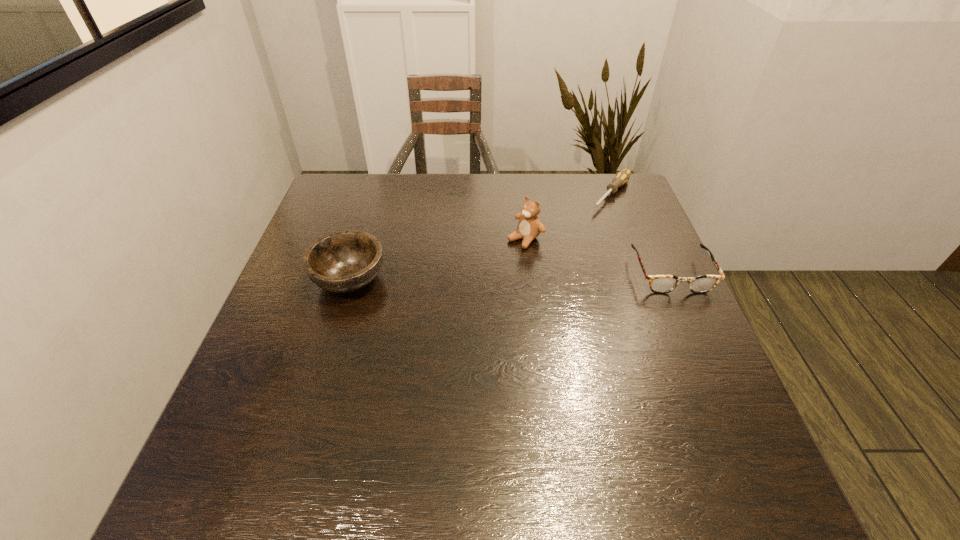
Where is `the second tallest object`? the second tallest object is located at coordinates (344, 261).

The image size is (960, 540). What are the coordinates of `the leftmost object` in the screenshot? It's located at (344, 261).

Identify the location of spectacles. (660, 284).

Find the location of a particular element. The height and width of the screenshot is (540, 960). the shortest object is located at coordinates (622, 177).

Identify the location of the farthest object. The width and height of the screenshot is (960, 540). (622, 177).

You are a GUI agent. You are given a task and a screenshot of the screen. Output one action in this format:
    pyautogui.click(x=<x>, y=<y>)
    Task: Click on the teddy bear
    
    Given the screenshot: What is the action you would take?
    pyautogui.click(x=529, y=227)

Where is `the third nearest object`? Image resolution: width=960 pixels, height=540 pixels. the third nearest object is located at coordinates (529, 227).

Locate an element on the screen. Image resolution: width=960 pixels, height=540 pixels. free space located 0.230m on the right of the third shortest object is located at coordinates (480, 280).

At what (x,y) coordinates should I click in order to perform the action: click on vacant space located on the frame of the third tallest object. Please return your answer as a coordinate pair (x, y). Image resolution: width=960 pixels, height=540 pixels. Looking at the image, I should click on (x=693, y=323).

Find the location of a particular element. The image size is (960, 540). free space located at the tip of the screwdriver is located at coordinates (584, 230).